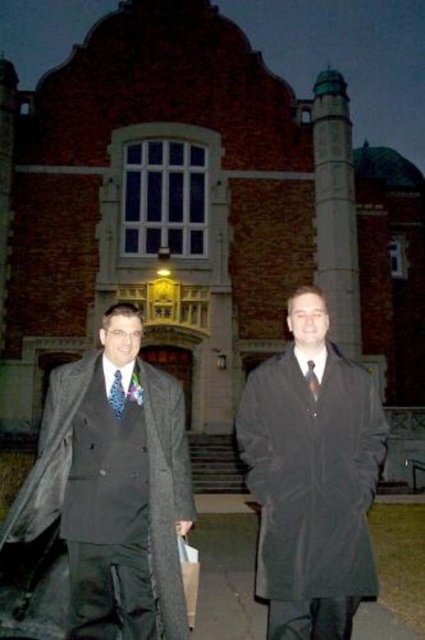
Question: Does matte gray coat at left appear on the left side of matte blue tie at left?

Choices:
 (A) no
 (B) yes

Answer: (B)

Question: Estimate the real-world distances between objects in this image. Which object is farther from the matte black tie at center?

Choices:
 (A) matte blue tie at left
 (B) matte gray coat at left

Answer: (B)

Question: Is matte gray coat at left positioned at the back of matte black coat at center?

Choices:
 (A) no
 (B) yes

Answer: (A)

Question: In this image, where is matte gray coat at left located relative to matte black coat at center?

Choices:
 (A) left
 (B) right

Answer: (A)

Question: Among these points, which one is farthest from the camera?

Choices:
 (A) (288, 435)
 (B) (122, 387)

Answer: (B)

Question: Which object is closer to the camera taking this photo?

Choices:
 (A) matte blue tie at left
 (B) matte black tie at center
 (C) matte black coat at center
 (D) matte gray coat at left

Answer: (D)